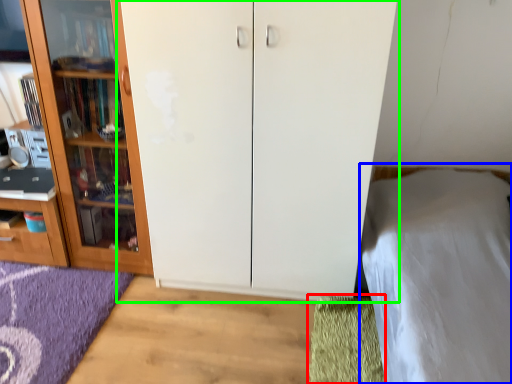
Question: Considering the real-world distances, which object is farthest from doormat (highlighted by a red box)? bed (highlighted by a blue box) or cupboard (highlighted by a green box)?

Choices:
 (A) bed
 (B) cupboard

Answer: (B)